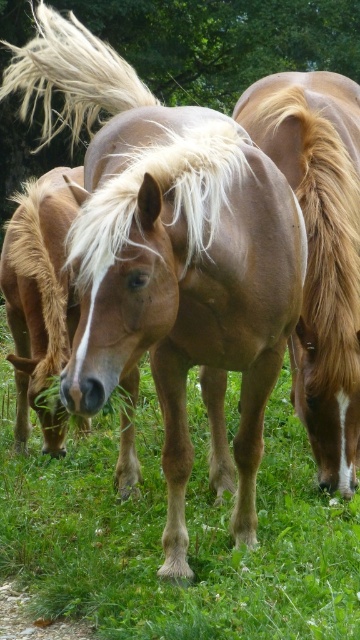
Does point (69, 612) lie in front of point (138, 218)?

No.

Can you confirm if brown glossy horse at center is smaller than white silky mane at center?

Incorrect, brown glossy horse at center is not smaller in size than white silky mane at center.

Locate an element on the screen. brown glossy horse at center is located at coordinates (187, 529).

This screenshot has height=640, width=360. What are the coordinates of `brown glossy horse at center` in the screenshot? It's located at (187, 529).

Is point (241, 564) closer to camera compared to point (353, 161)?

That is True.

Between brown glossy horse at center and light brown glossy horse at center, which one has less height?

Standing shorter between the two is brown glossy horse at center.

Which is behind, point (285, 390) or point (289, 92)?

The point (285, 390) is behind.

You are a GUI agent. You are given a task and a screenshot of the screen. Output one action in this format:
    pyautogui.click(x=<x>, y=<y>)
    Task: Click on the brown glossy horse at center
    Image resolution: width=360 pixels, height=640 pixels.
    Given the screenshot: What is the action you would take?
    pyautogui.click(x=187, y=529)

Identify the location of light brown glossy horse at center. (320, 252).

Can you confirm if light brown glossy horse at center is bigger than white silky mane at center?

Correct, light brown glossy horse at center is larger in size than white silky mane at center.

Which is in front, point (339, 266) or point (218, 193)?

Positioned in front is point (218, 193).

The width and height of the screenshot is (360, 640). I want to click on light brown glossy horse at center, so click(x=320, y=252).